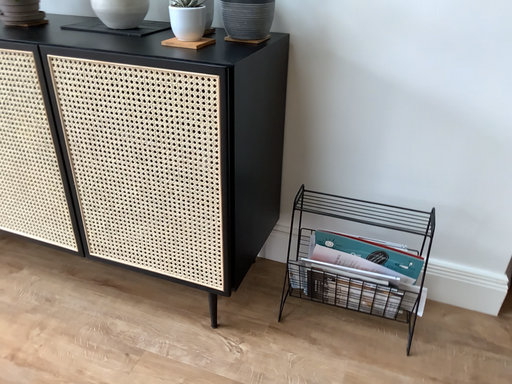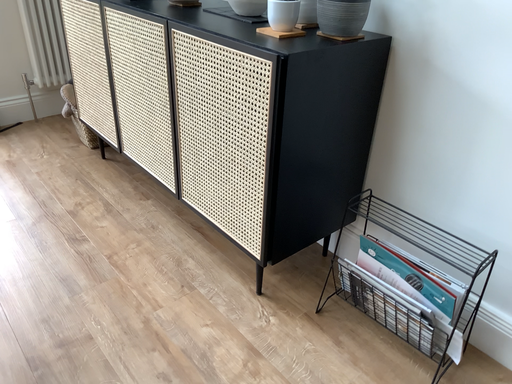
Question: How did the camera likely rotate when shooting the video?

Choices:
 (A) rotated right
 (B) rotated left

Answer: (B)